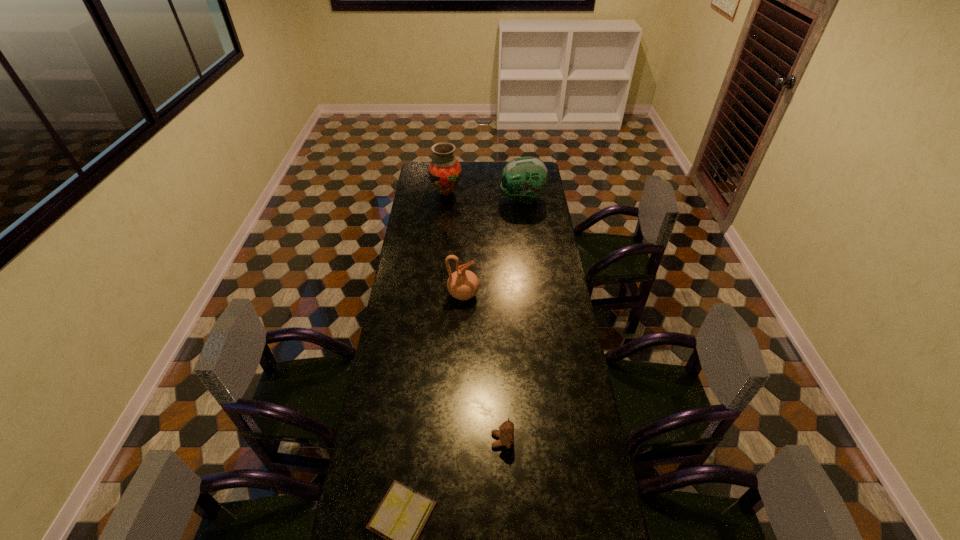
I want to click on free space that is in between the third nearest object and the vase, so point(455,243).

Locate an element on the screen. This screenshot has height=540, width=960. vacant area that lies between the football helmet and the pottery is located at coordinates (492, 246).

Image resolution: width=960 pixels, height=540 pixels. I want to click on free space between the football helmet and the third farthest object, so click(492, 246).

The width and height of the screenshot is (960, 540). I want to click on empty space between the second shortest object and the third farthest object, so click(x=483, y=367).

Where is `object that is the third closest one to the football helmet`? The image size is (960, 540). object that is the third closest one to the football helmet is located at coordinates (506, 431).

The width and height of the screenshot is (960, 540). What are the coordinates of `the closest object to the football helmet` in the screenshot? It's located at (444, 171).